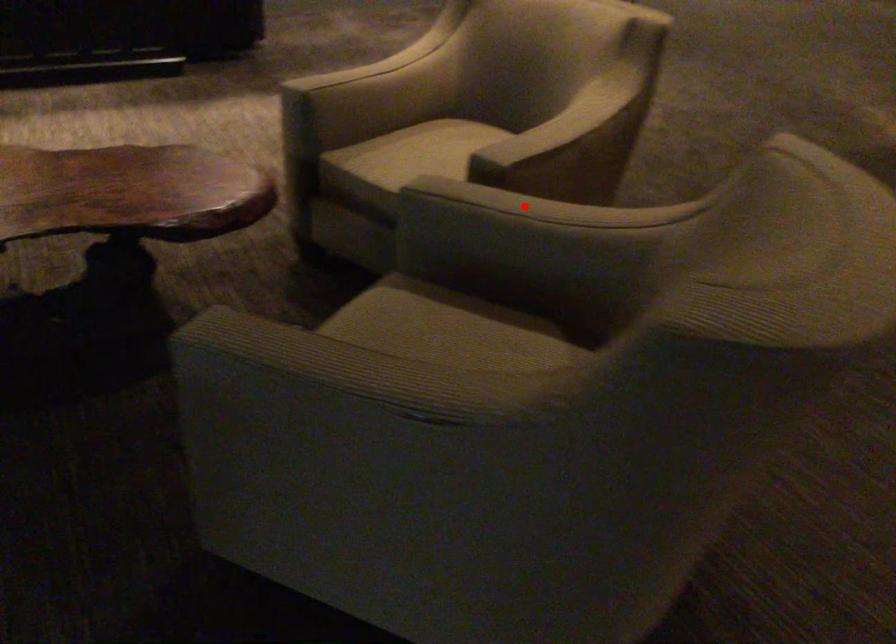
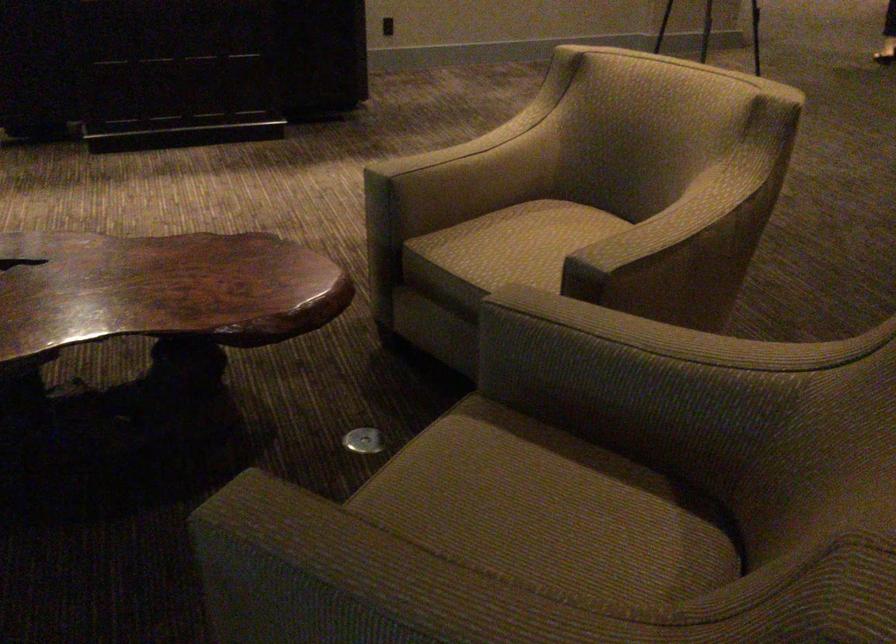
Where in the second image is the point corresponding to the highlighted location from the first image?

(631, 330)